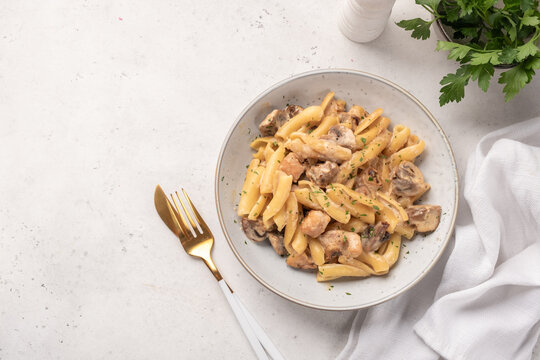
At what (x,y) coordinates should I click in order to perform the action: click on you hold the cutlery here. Please return your answer as a coordinate pair (x, y). Looking at the image, I should click on (249, 337), (261, 334).